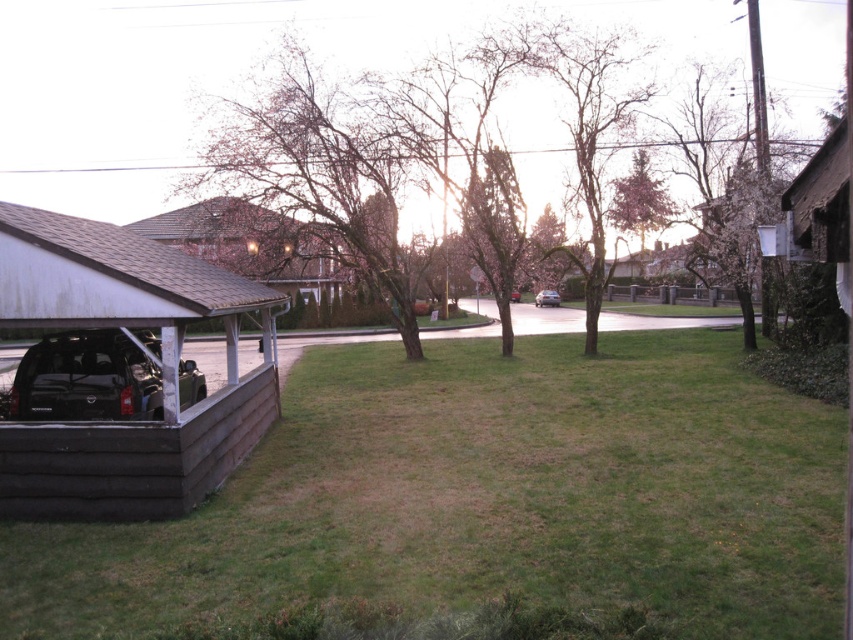
Does green grass at lower center have a greater width compared to brown shingled hut at left?

No, green grass at lower center is not wider than brown shingled hut at left.

Does green grass at lower center appear over brown shingled hut at left?

Incorrect, green grass at lower center is not positioned above brown shingled hut at left.

Is point (250, 456) farther from viewer compared to point (305, 252)?

No.

Image resolution: width=853 pixels, height=640 pixels. What are the coordinates of `green grass at lower center` in the screenshot? It's located at (486, 497).

Is green grass at lower center bigger than satin silver sedan at center?

Yes, green grass at lower center is bigger than satin silver sedan at center.

Can you confirm if green grass at lower center is smaller than satin silver sedan at center?

Actually, green grass at lower center might be larger than satin silver sedan at center.

What do you see at coordinates (486, 497) in the screenshot? I see `green grass at lower center` at bounding box center [486, 497].

Locate an element on the screen. This screenshot has height=640, width=853. green grass at lower center is located at coordinates (486, 497).

Does point (39, 224) lie in front of point (512, 300)?

That is True.

Which is below, wooden carport at lower left or metallic silver sedan at center?

wooden carport at lower left is below.

Between point (206, 262) and point (517, 292), which one is positioned behind?

Point (517, 292)

Locate an element on the screen. The height and width of the screenshot is (640, 853). wooden carport at lower left is located at coordinates (160, 371).